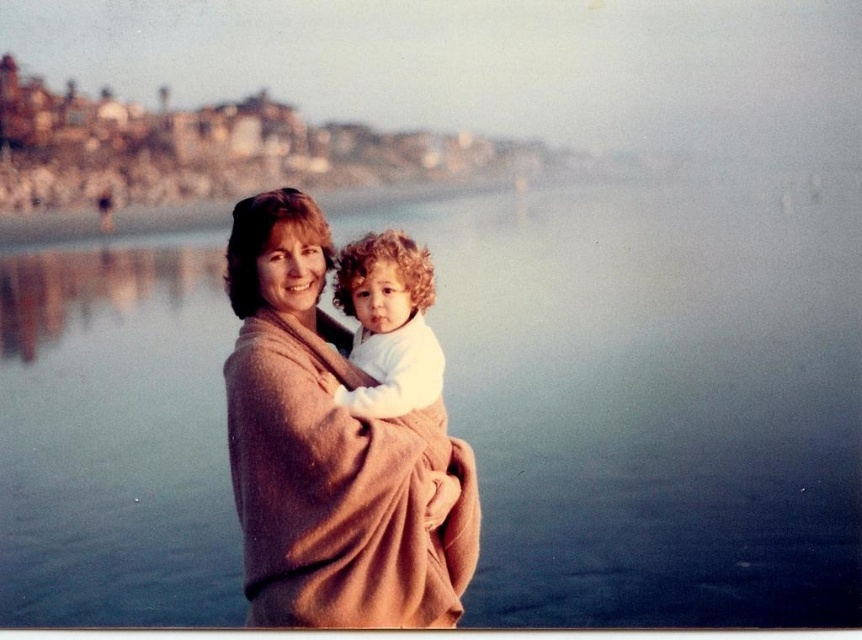
You are a photographer trying to capture a closeup of the beige wool sweater at center without the white soft fabric at center blocking the view. Is this possible based on their current positions?

Yes, the beige wool sweater at center is in front of the white soft fabric at center, so you can take a closeup of the beige wool sweater at center without the white soft fabric at center blocking the view.